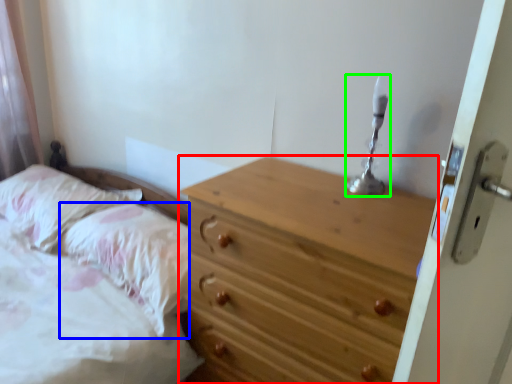
Question: Based on their relative distances, which object is nearer to chest of drawers (highlighted by a red box)? Choose from pillow (highlighted by a blue box) and candle holder (highlighted by a green box).

Choices:
 (A) pillow
 (B) candle holder

Answer: (B)